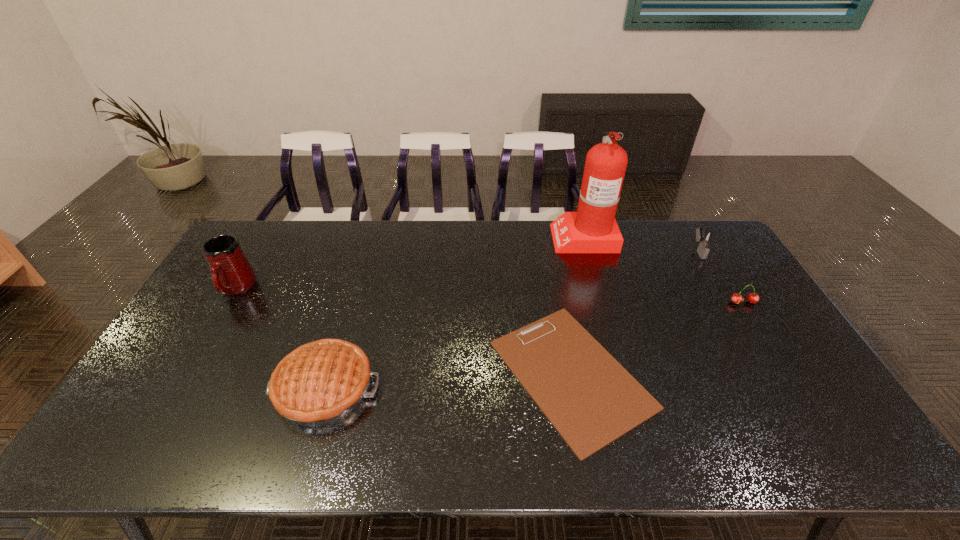
At what (x,y) coordinates should I click in order to perform the action: click on vacant space located 0.050m on the side of the fifth shortest object with the handle. Please return your answer as a coordinate pair (x, y). Looking at the image, I should click on (219, 318).

Find the location of a particular element. This screenshot has width=960, height=540. vacant point located on the left of the igniter is located at coordinates (660, 251).

Find the location of a particular element. free region located on the back of the pie is located at coordinates (349, 308).

I want to click on free spot located 0.120m with stems pointing upwards on the cherry, so click(x=764, y=336).

Find the location of a particular element. free space located 0.080m on the right of the shortest object is located at coordinates (681, 374).

The height and width of the screenshot is (540, 960). Identify the location of fire extinguisher that is positioned at the far edge. (592, 229).

The height and width of the screenshot is (540, 960). In order to click on igniter present at the far edge in this screenshot , I will do `click(705, 238)`.

Find the location of a particular element. This screenshot has width=960, height=540. pie that is at the near edge is located at coordinates (321, 382).

Locate an element on the screen. The height and width of the screenshot is (540, 960). clipboard present at the near edge is located at coordinates (588, 396).

Locate an element on the screen. The image size is (960, 540). object that is at the left edge is located at coordinates (232, 274).